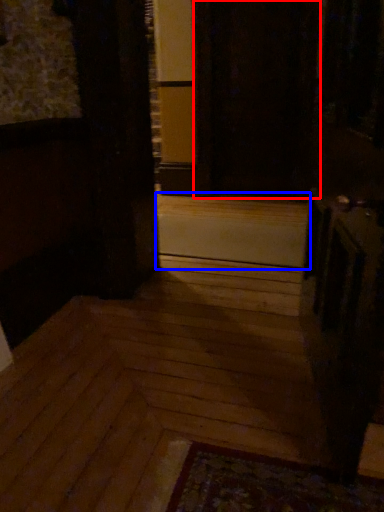
Question: Which point is closer to the camera, screen door (highlighted by a red box) or stairwell (highlighted by a blue box)?

Choices:
 (A) screen door
 (B) stairwell

Answer: (B)